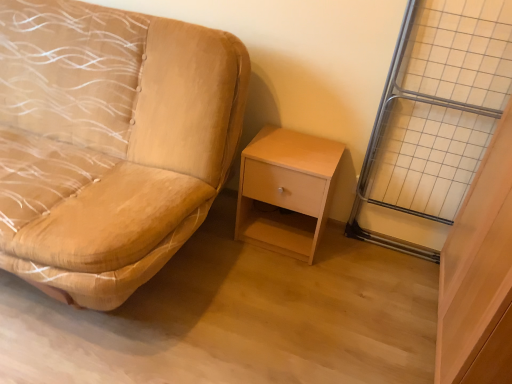
Find the location of a particular element. This screenshot has width=512, height=384. vacant area situated to the left side of metal grid at right is located at coordinates (347, 257).